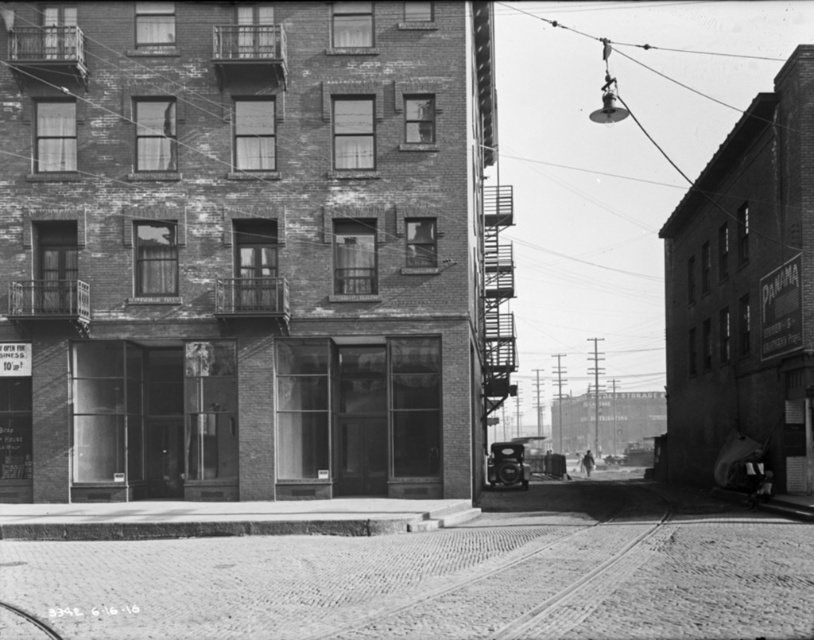
Is metallic car at center above dark gray fabric man at center?

Yes, metallic car at center is above dark gray fabric man at center.

Who is more distant from viewer, [504,449] or [593,461]?

Point [593,461]

Locate an element on the screen. This screenshot has height=640, width=814. metallic car at center is located at coordinates (506, 465).

Is dark gray fabric jacket at lower right positioned before dark gray fabric man at center?

Yes, it is.

Is dark gray fabric jacket at lower right shorter than dark gray fabric man at center?

Yes, dark gray fabric jacket at lower right is shorter than dark gray fabric man at center.

Is point (756, 490) closer to camera compared to point (589, 451)?

Yes, point (756, 490) is closer to viewer.

Locate an element on the screen. Image resolution: width=814 pixels, height=640 pixels. dark gray fabric jacket at lower right is located at coordinates (755, 477).

Between metallic car at center and dark gray fabric jacket at lower right, which one has more height?

With more height is metallic car at center.

Between metallic car at center and dark gray fabric jacket at lower right, which one is positioned higher?

dark gray fabric jacket at lower right is above.

Which is behind, point (508, 460) or point (758, 465)?

The point (508, 460) is more distant.

Image resolution: width=814 pixels, height=640 pixels. I want to click on metallic car at center, so coord(506,465).